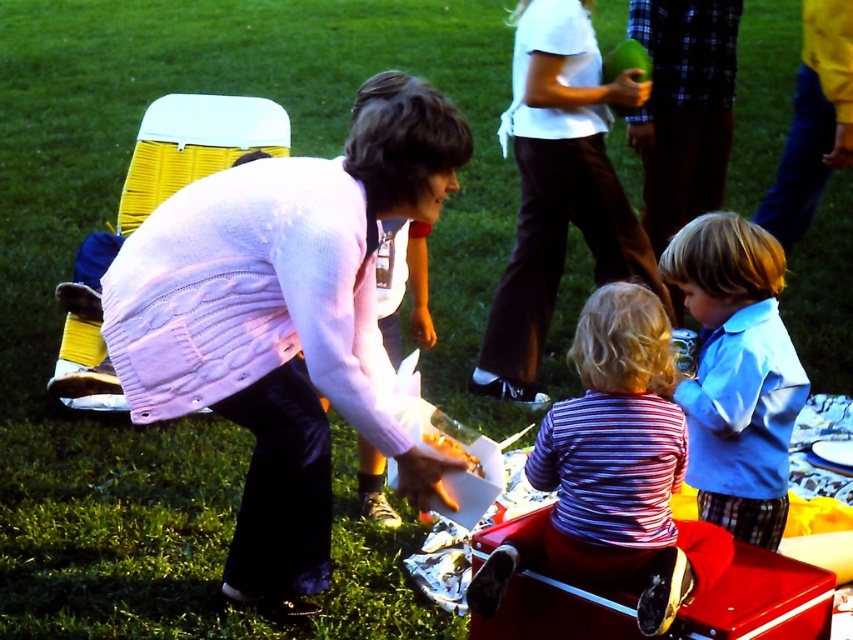
You are standing in the picnic area and want to place a new item between the two points, point (x=712, y=458) and point (x=706, y=184). Which point should the item be closer to in order to be closer to you?

The item should be placed closer to point (x=712, y=458) because it is closer to the viewer than point (x=706, y=184).

You are a photographer standing at the edge of the grassy area. You want to take a photo of the striped cotton shirt at center while holding your camera. Can you comfortably reach the camera to take the photo without moving your position?

The striped cotton shirt at center and camera are 2.43 meters apart. Since the distance between them is over 2 meters, you can comfortably reach the camera to take the photo without moving your position.

You are at a picnic and see a woman wearing the pink knit sweater at center and plaid fabric pants at right. Which piece of clothing is positioned to the right side of the woman?

The plaid fabric pants at right are positioned to the right side of the woman.